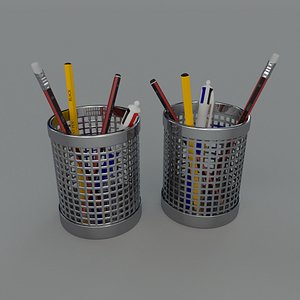
Locate an element on the screen. writing utensils in silver cups is located at coordinates (52, 95), (71, 93), (113, 93), (131, 113), (161, 96), (187, 94), (203, 101), (256, 88).